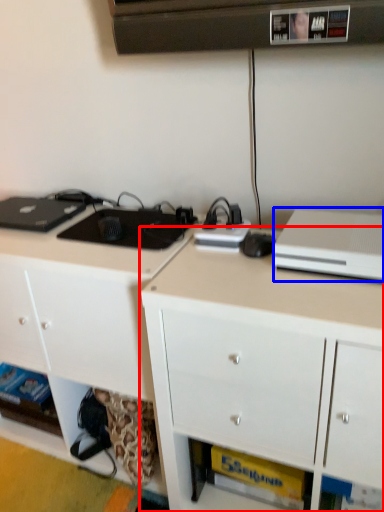
Question: Among these objects, which one is nearest to the camera, cabinetry (highlighted by a red box) or desktop computer (highlighted by a blue box)?

Choices:
 (A) cabinetry
 (B) desktop computer

Answer: (A)